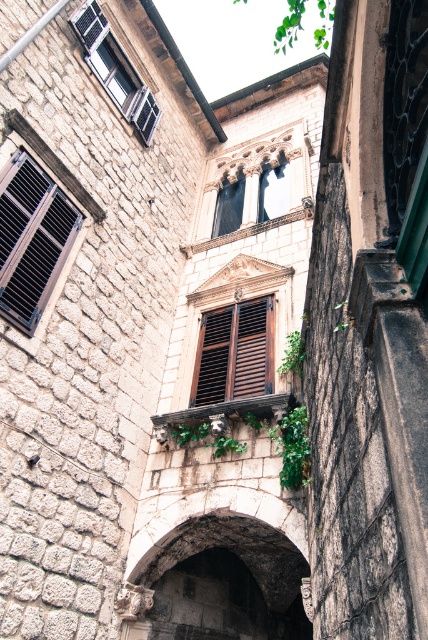
You are an architect designing a new building inspired by this historic style. You need to ensure that the dark stone archway at center and the green leafy ivy at upper center maintain their proportional relationship as seen in the original image. Which element should you make wider to stay true to the design?

To stay true to the design, the green leafy ivy at upper center should be made wider since its width in the original image is greater than the dark stone archway at center.

You are an architect assessing the symmetry of the building. You notice the dark stone archway at center and the brown wooden shutters at center. Which of these two elements has a wider structure?

The brown wooden shutters at center have a greater width than the dark stone archway at center, as stated in the description that the dark stone archway at center has a lesser width compared to brown wooden shutters at center.

You are a maintenance worker needing to inspect both the dark stone archway at center and the green leafy ivy at upper center. Given that your ladder can extend up to 100 meters, can you safely reach both objects with the ladder?

The distance between the dark stone archway at center and green leafy ivy at upper center is 117.25 meters, which exceeds the ladder extension limit of 100 meters. Therefore, the ladder cannot safely reach both objects simultaneously.